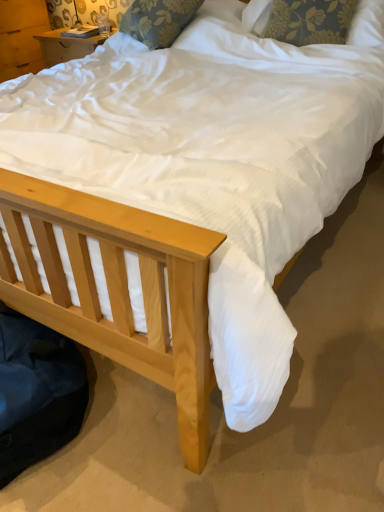
Question: Is floral fabric pillow at upper center, acting as the second pillow starting from the right, touching floral fabric pillow at upper center, the second pillow in the left-to-right sequence?

Choices:
 (A) yes
 (B) no

Answer: (B)

Question: Can you confirm if floral fabric pillow at upper center, acting as the second pillow starting from the right, is bigger than floral fabric pillow at upper center, the second pillow in the left-to-right sequence?

Choices:
 (A) yes
 (B) no

Answer: (A)

Question: Considering the relative positions of floral fabric pillow at upper center, acting as the second pillow starting from the right, and floral fabric pillow at upper center, acting as the first pillow starting from the right, in the image provided, is floral fabric pillow at upper center, acting as the second pillow starting from the right, in front of floral fabric pillow at upper center, acting as the first pillow starting from the right,?

Choices:
 (A) no
 (B) yes

Answer: (A)

Question: Is floral fabric pillow at upper center, marked as the 1th pillow in a left-to-right arrangement, wider than floral fabric pillow at upper center, acting as the first pillow starting from the right?

Choices:
 (A) no
 (B) yes

Answer: (B)

Question: Does floral fabric pillow at upper center, acting as the second pillow starting from the right, have a lesser height compared to floral fabric pillow at upper center, the second pillow in the left-to-right sequence?

Choices:
 (A) no
 (B) yes

Answer: (B)

Question: From the image's perspective, is floral fabric pillow at upper center, acting as the second pillow starting from the right, on floral fabric pillow at upper center, the second pillow in the left-to-right sequence?

Choices:
 (A) yes
 (B) no

Answer: (A)

Question: Is floral fabric pillow at upper center, the second pillow in the left-to-right sequence, outside floral fabric pillow at upper center, marked as the 1th pillow in a left-to-right arrangement?

Choices:
 (A) no
 (B) yes

Answer: (B)

Question: From the image's perspective, is floral fabric pillow at upper center, the second pillow in the left-to-right sequence, below floral fabric pillow at upper center, marked as the 1th pillow in a left-to-right arrangement?

Choices:
 (A) no
 (B) yes

Answer: (B)

Question: Is floral fabric pillow at upper center, the second pillow in the left-to-right sequence, bigger than floral fabric pillow at upper center, acting as the second pillow starting from the right?

Choices:
 (A) yes
 (B) no

Answer: (B)

Question: Is floral fabric pillow at upper center, the second pillow in the left-to-right sequence, taller than floral fabric pillow at upper center, marked as the 1th pillow in a left-to-right arrangement?

Choices:
 (A) no
 (B) yes

Answer: (B)

Question: From the image's perspective, is floral fabric pillow at upper center, the second pillow in the left-to-right sequence, on top of floral fabric pillow at upper center, acting as the second pillow starting from the right?

Choices:
 (A) yes
 (B) no

Answer: (B)

Question: Would you say floral fabric pillow at upper center, the second pillow in the left-to-right sequence, is a long distance from floral fabric pillow at upper center, acting as the second pillow starting from the right?

Choices:
 (A) no
 (B) yes

Answer: (A)

Question: In terms of height, does floral fabric pillow at upper center, acting as the first pillow starting from the right, look taller or shorter compared to floral fabric pillow at upper center, acting as the second pillow starting from the right?

Choices:
 (A) short
 (B) tall

Answer: (B)